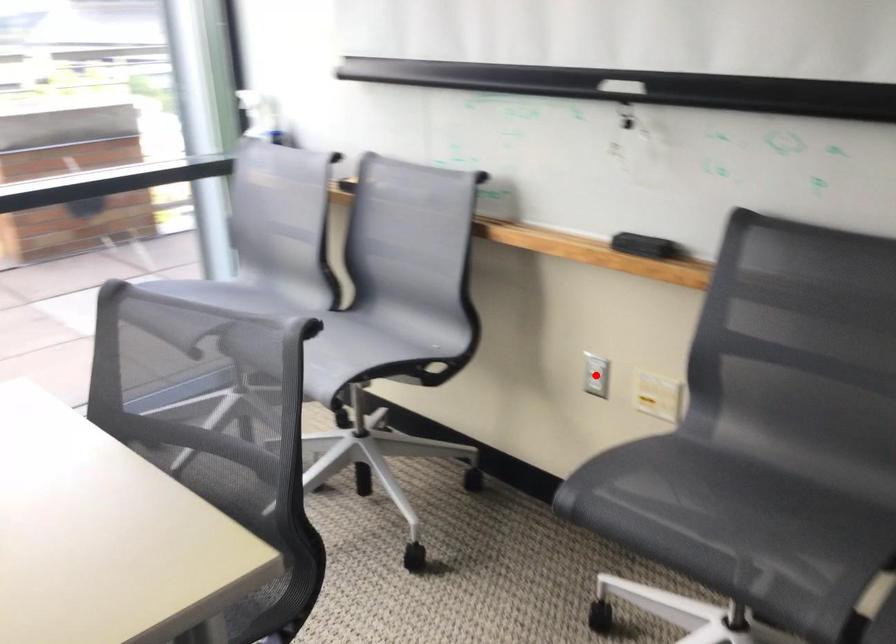
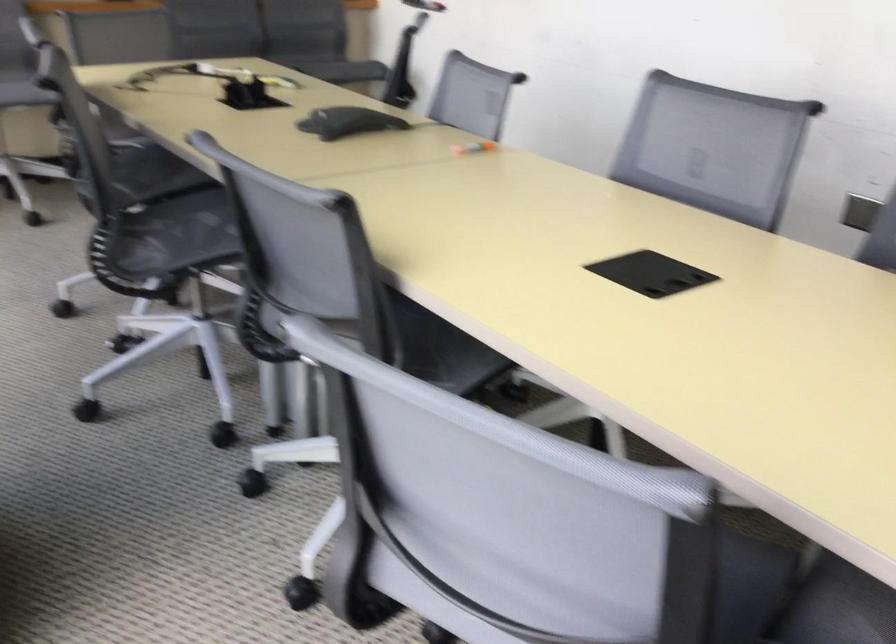
Question: I am providing you with two images of the same scene from different viewpoints. A red point is marked on the first image. At the location where the point appears in image 1, is it still visible in image 2?

Choices:
 (A) Yes
 (B) No

Answer: (B)